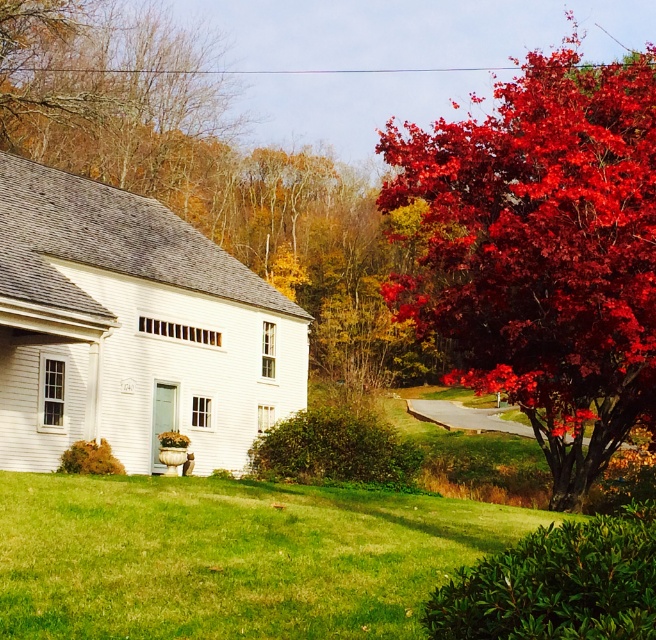
You are a gardener planning to plant a new tree in the yard of the white house with gray shingled roof. The shiny crimson maple at right and the green grass at lower center are already present. Considering their sizes, which existing element would require more space if you want to add another tree?

The shiny crimson maple at right requires more space since it is larger in size than the green grass at lower center.

You are a gardener who wants to plant a new flower bed between the shiny crimson maple at right and the green grass at lower center. Which object should you consider for height compatibility?

The shiny crimson maple at right is taller than the green grass at lower center, so you should consider the height of the shiny crimson maple at right to ensure the flower bed complements its height.

Looking at this image, you are standing at the front door of the white house and want to walk to the shiny crimson maple at right. Which direction should you head relative to the green grass at lower center?

You should head to the right side of the green grass at lower center, as the shiny crimson maple at right is positioned on the right side of it.